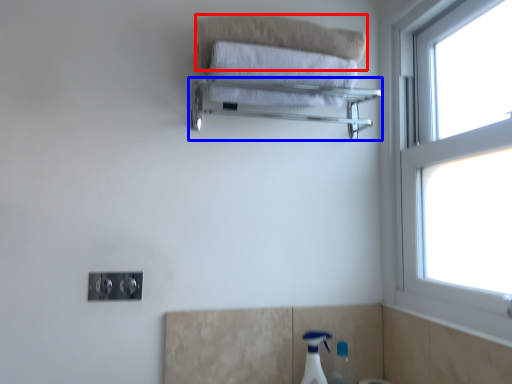
Question: Which object appears closest to the camera in this image, bath towel (highlighted by a red box) or balustrade (highlighted by a blue box)?

Choices:
 (A) bath towel
 (B) balustrade

Answer: (B)